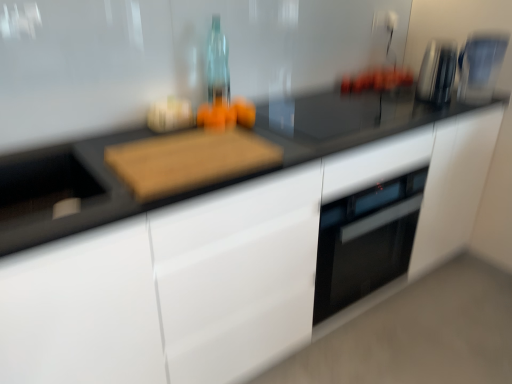
Question: Is satin silver toaster at upper right further to camera compared to sleek metallic coffee machine at upper right?

Choices:
 (A) yes
 (B) no

Answer: (B)

Question: Considering the relative sizes of satin silver toaster at upper right and sleek metallic coffee machine at upper right in the image provided, is satin silver toaster at upper right smaller than sleek metallic coffee machine at upper right?

Choices:
 (A) no
 (B) yes

Answer: (B)

Question: Is satin silver toaster at upper right bigger than sleek metallic coffee machine at upper right?

Choices:
 (A) no
 (B) yes

Answer: (A)

Question: Could you tell me if satin silver toaster at upper right is facing sleek metallic coffee machine at upper right?

Choices:
 (A) no
 (B) yes

Answer: (A)

Question: Is sleek metallic coffee machine at upper right at the back of satin silver toaster at upper right?

Choices:
 (A) yes
 (B) no

Answer: (B)

Question: Looking at the image, does sleek metallic coffee machine at upper right seem bigger or smaller compared to wooden cutting board at center?

Choices:
 (A) big
 (B) small

Answer: (A)

Question: Would you say sleek metallic coffee machine at upper right is to the left or to the right of wooden cutting board at center in the picture?

Choices:
 (A) left
 (B) right

Answer: (B)

Question: Considering their positions, is sleek metallic coffee machine at upper right located in front of or behind wooden cutting board at center?

Choices:
 (A) behind
 (B) front

Answer: (A)

Question: From the image's perspective, relative to wooden cutting board at center, is sleek metallic coffee machine at upper right above or below?

Choices:
 (A) above
 (B) below

Answer: (A)

Question: Looking at their shapes, would you say satin silver toaster at upper right is wider or thinner than wooden cutting board at center?

Choices:
 (A) wide
 (B) thin

Answer: (B)

Question: Would you say satin silver toaster at upper right is inside or outside wooden cutting board at center?

Choices:
 (A) outside
 (B) inside

Answer: (A)

Question: Would you say satin silver toaster at upper right is to the left or to the right of wooden cutting board at center in the picture?

Choices:
 (A) left
 (B) right

Answer: (B)

Question: Considering the positions of satin silver toaster at upper right and wooden cutting board at center in the image, is satin silver toaster at upper right bigger or smaller than wooden cutting board at center?

Choices:
 (A) small
 (B) big

Answer: (B)

Question: From the image's perspective, is sleek metallic coffee machine at upper right above or below orange matte oranges at center?

Choices:
 (A) above
 (B) below

Answer: (A)

Question: From a real-world perspective, is sleek metallic coffee machine at upper right positioned above or below orange matte oranges at center?

Choices:
 (A) above
 (B) below

Answer: (A)